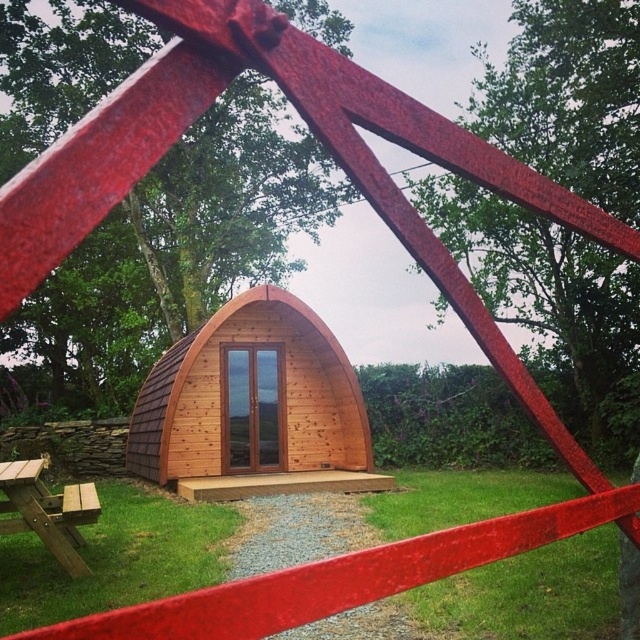
You are standing in front of the wooden pod and notice two points marked in the scene. The first point is at coordinates point (292,432) and the second is at point (45,493). Which point is closer to your current position?

Point (292,432) is further to the camera than point (45,493), so the point closer to your current position is point (45,493).

You are planning to set up a small tent between the wooden cabin at center and the wooden picnic table at lower left. Given that the cabin is wider than the picnic table, which object should you place the tent closer to in order to ensure it fits within the available space?

Since the wooden cabin at center is wider than the wooden picnic table at lower left, you should place the tent closer to the wooden picnic table at lower left to ensure it fits within the available space.